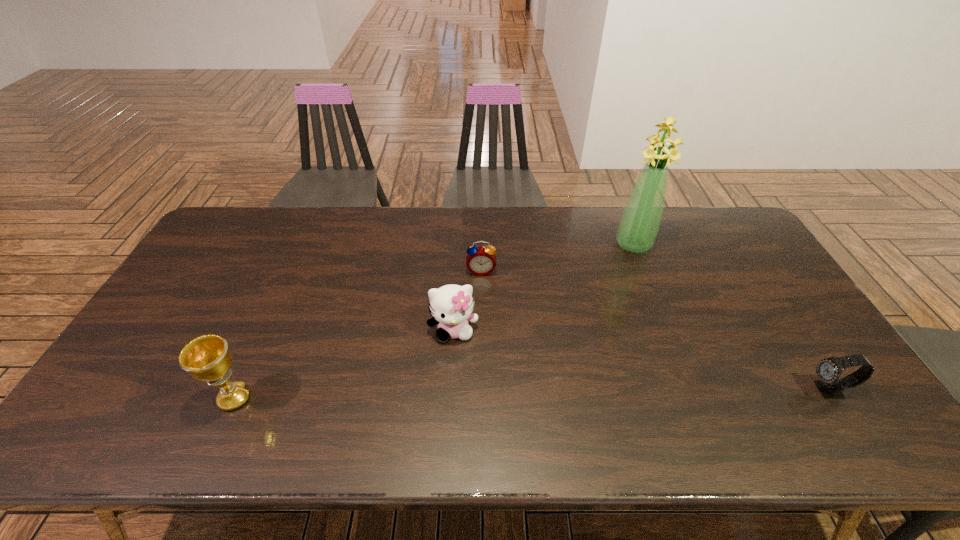
Find the location of `object positioned at the far edge`. object positioned at the far edge is located at coordinates (639, 224).

Identify the location of chalice positioned at the near edge. Image resolution: width=960 pixels, height=540 pixels. (207, 358).

Identify the location of watch that is at the near edge. This screenshot has width=960, height=540. (828, 370).

This screenshot has width=960, height=540. Find the location of `object located at the right edge`. object located at the right edge is located at coordinates (828, 370).

Locate an element on the screen. This screenshot has width=960, height=540. object that is at the near right corner is located at coordinates (828, 370).

This screenshot has width=960, height=540. In order to click on free space at the far edge in this screenshot , I will do `click(531, 244)`.

The width and height of the screenshot is (960, 540). In the image, there is a desktop. What are the coordinates of `vacant area at the near edge` in the screenshot? It's located at (612, 384).

The height and width of the screenshot is (540, 960). Identify the location of vacant space at the left edge of the desktop. (134, 356).

Find the location of a particular element. This screenshot has height=540, width=960. vacant space at the right edge of the desktop is located at coordinates (762, 258).

At what (x,y) coordinates should I click in order to perform the action: click on vacant area at the far left corner. Please return your answer as a coordinate pair (x, y). The image size is (960, 540). Looking at the image, I should click on (241, 228).